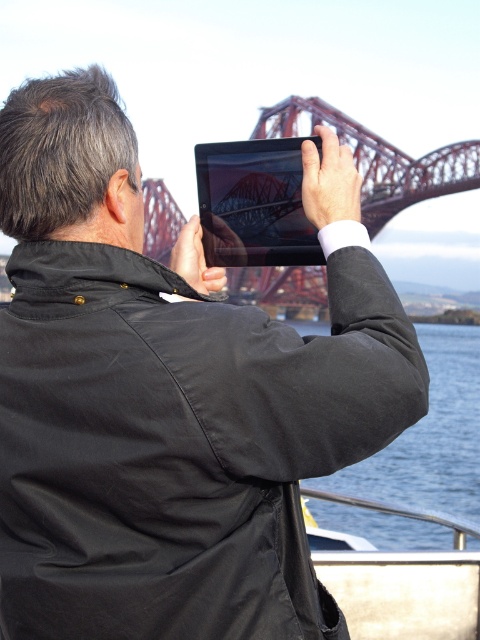
Question: Does metallic silver boat at lower right have a greater width compared to matte black tablet at upper center?

Choices:
 (A) yes
 (B) no

Answer: (A)

Question: Can you confirm if blue water at lower right is smaller than metallic silver boat at lower right?

Choices:
 (A) no
 (B) yes

Answer: (A)

Question: Which of the following is the closest to the observer?

Choices:
 (A) matte black tablet at upper center
 (B) metallic silver boat at lower right
 (C) blue water at lower right

Answer: (C)

Question: Which of the following is the farthest from the observer?

Choices:
 (A) blue water at lower right
 (B) matte black tablet at upper center

Answer: (B)

Question: Among these objects, which one is farthest from the camera?

Choices:
 (A) metallic silver boat at lower right
 (B) matte black tablet at upper center

Answer: (A)

Question: Is blue water at lower right bigger than metallic silver boat at lower right?

Choices:
 (A) no
 (B) yes

Answer: (B)